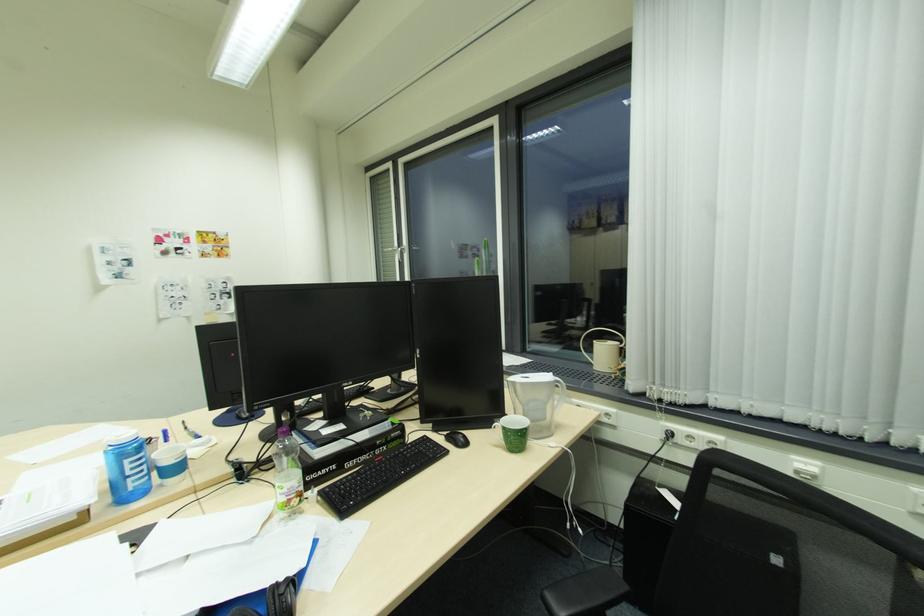
Where would you leaning on the chair armrest? Please return your answer as a coordinate pair (x, y).

(585, 593)